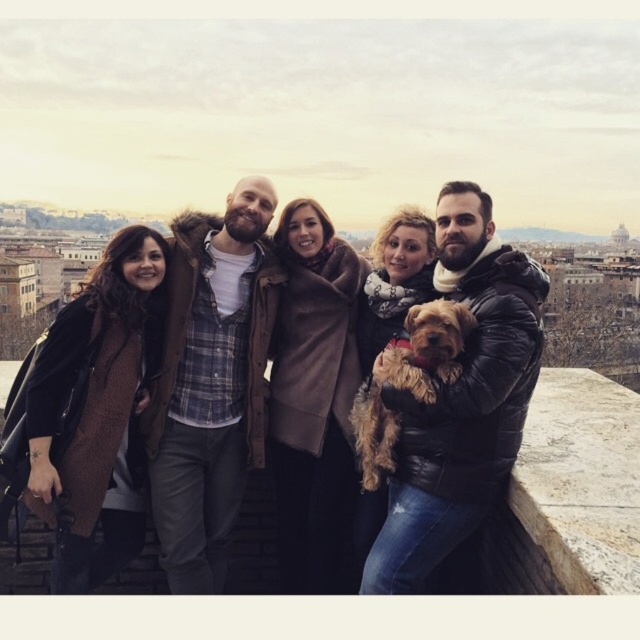
In the scene shown: You are a photographer trying to capture a closeup of the black leather jacket at center and the brown woolen scarf at upper center in the image. Which object should you focus on first if you want to ensure both are in focus without moving the camera?

The brown woolen scarf at upper center should be focused on first because it is closer to the camera than the black leather jacket at center. By focusing on the closer object, the farther one may still be within the depth of field, ensuring both are in focus.

You are a photographer adjusting your camera to focus on two points in the scene. The first point is at coordinates point (396, 470) and the second is at point (371, 401). Which point should you focus on first if you want to ensure the closest object is in sharp focus?

Point (396, 470) is closer to the camera than point (371, 401), so you should focus on point (396, 470) first to ensure the closest object is in sharp focus.

You are a photographer trying to capture a clear shot of the fuzzy brown dog at center. However, the black leather jacket at center is blocking your view. Can you adjust your angle to see the dog without the jacket obstructing it?

The black leather jacket at center is below the fuzzy brown dog at center, so adjusting your angle upwards slightly should allow you to see the dog without the jacket blocking the view.